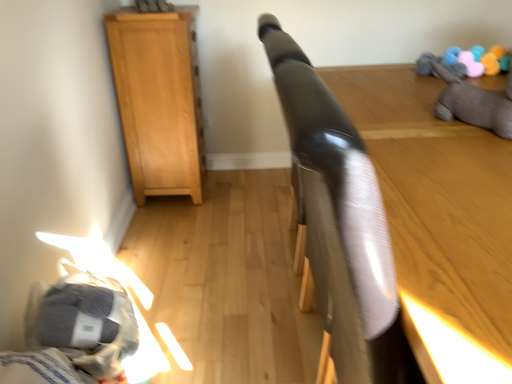
Question: In the image, is soft woolen balls at upper right positioned in front of or behind glossy black headboard at upper center, which ranks as the 2th furniture in left-to-right order?

Choices:
 (A) front
 (B) behind

Answer: (B)

Question: Choose the correct answer: Is soft woolen balls at upper right inside glossy black headboard at upper center, the 1th furniture when ordered from right to left, or outside it?

Choices:
 (A) inside
 (B) outside

Answer: (B)

Question: Which object is positioned closest to the gray fabric bed at lower left?

Choices:
 (A) light brown wood cabinet at left, marked as the 1th furniture in a back-to-front arrangement
 (B) soft woolen balls at upper right
 (C) glossy black headboard at upper center, which ranks as the 2th furniture in left-to-right order
 (D) gray plush toy at upper right

Answer: (C)

Question: Estimate the real-world distances between objects in this image. Which object is farther from the gray fabric bed at lower left?

Choices:
 (A) glossy black headboard at upper center, the first furniture viewed from the front
 (B) gray plush toy at upper right
 (C) light brown wood cabinet at left, the 1th furniture from the left
 (D) soft woolen balls at upper right

Answer: (D)